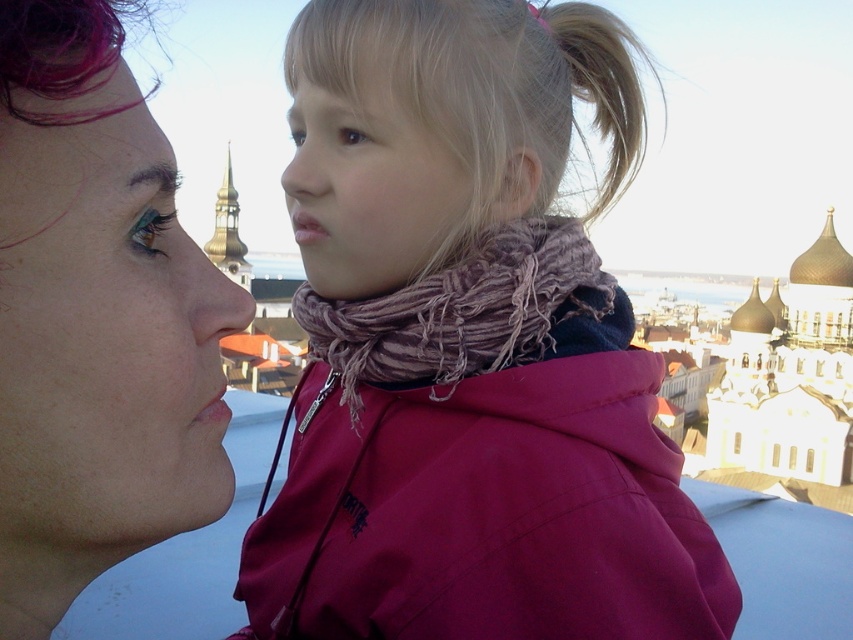
You are a photographer standing 10 meters away from the two subjects in the image. You want to capture a photo that includes both the woolen scarf at center and the blonde hair at upper center in the same frame. Given that your camera has a maximum zoom range of 20 meters, will you be able to fit both objects into the frame without moving closer?

The distance between the woolen scarf at center and the blonde hair at upper center is 16.46 meters. Since your camera can zoom up to 20 meters, which is greater than the distance between the two objects, you can fit both into the frame without moving closer.